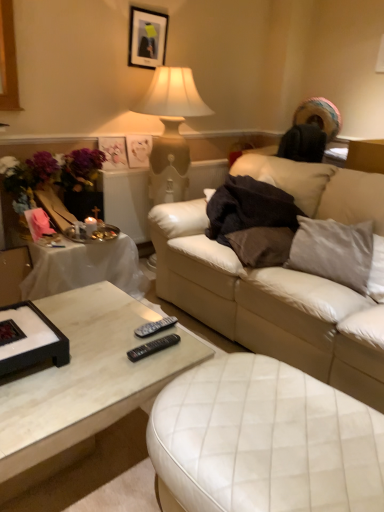
Question: Is matte white picture frame at upper center, the 2th picture frame when ordered from top to bottom, bigger than white leather ottoman at center?

Choices:
 (A) no
 (B) yes

Answer: (A)

Question: From the image's perspective, would you say matte white picture frame at upper center, the second picture frame in the bottom-to-top sequence, is shown under white leather ottoman at center?

Choices:
 (A) no
 (B) yes

Answer: (A)

Question: Can you confirm if matte white picture frame at upper center, the second picture frame in the bottom-to-top sequence, is taller than white leather ottoman at center?

Choices:
 (A) yes
 (B) no

Answer: (B)

Question: Is matte white picture frame at upper center, the 2th picture frame when ordered from top to bottom, in front of white leather ottoman at center?

Choices:
 (A) yes
 (B) no

Answer: (B)

Question: Is matte white picture frame at upper center, the 2th picture frame when ordered from top to bottom, at the right side of white leather ottoman at center?

Choices:
 (A) no
 (B) yes

Answer: (A)

Question: In terms of width, does black plastic remote at center, which is counted as the first remote, starting from the back, look wider or thinner when compared to black plastic remote at lower center, the second remote in the back-to-front sequence?

Choices:
 (A) thin
 (B) wide

Answer: (B)

Question: From the image's perspective, is black plastic remote at center, which is counted as the first remote, starting from the back, located above or below black plastic remote at lower center, the second remote in the back-to-front sequence?

Choices:
 (A) below
 (B) above

Answer: (B)

Question: Considering the positions of black plastic remote at center, which is counted as the first remote, starting from the back, and black plastic remote at lower center, which is counted as the 1th remote, starting from the front, in the image, is black plastic remote at center, which is counted as the first remote, starting from the back, taller or shorter than black plastic remote at lower center, which is counted as the 1th remote, starting from the front,?

Choices:
 (A) tall
 (B) short

Answer: (A)

Question: Considering the positions of black plastic remote at center, which is counted as the first remote, starting from the back, and black plastic remote at lower center, which is counted as the 1th remote, starting from the front, in the image, is black plastic remote at center, which is counted as the first remote, starting from the back, bigger or smaller than black plastic remote at lower center, which is counted as the 1th remote, starting from the front,?

Choices:
 (A) big
 (B) small

Answer: (A)

Question: Considering the positions of leather couch at center and matte black picture frame at upper center, positioned as the first picture frame in top-to-bottom order, in the image, is leather couch at center taller or shorter than matte black picture frame at upper center, positioned as the first picture frame in top-to-bottom order,?

Choices:
 (A) tall
 (B) short

Answer: (A)

Question: From a real-world perspective, is leather couch at center physically located above or below matte black picture frame at upper center, which ranks as the 3th picture frame in bottom-to-top order?

Choices:
 (A) below
 (B) above

Answer: (A)

Question: Looking at the image, does leather couch at center seem bigger or smaller compared to matte black picture frame at upper center, which ranks as the 3th picture frame in bottom-to-top order?

Choices:
 (A) big
 (B) small

Answer: (A)

Question: In the image, is leather couch at center positioned in front of or behind matte black picture frame at upper center, which ranks as the 3th picture frame in bottom-to-top order?

Choices:
 (A) behind
 (B) front

Answer: (B)

Question: Is matte plastic picture frame at upper left, which appears as the 1th picture frame when ordered from the bottom, inside or outside of matte black picture frame at upper center, which ranks as the 3th picture frame in bottom-to-top order?

Choices:
 (A) outside
 (B) inside

Answer: (A)

Question: From the image's perspective, is matte plastic picture frame at upper left, the 3th picture frame when ordered from top to bottom, located above or below matte black picture frame at upper center, positioned as the first picture frame in top-to-bottom order?

Choices:
 (A) above
 (B) below

Answer: (B)